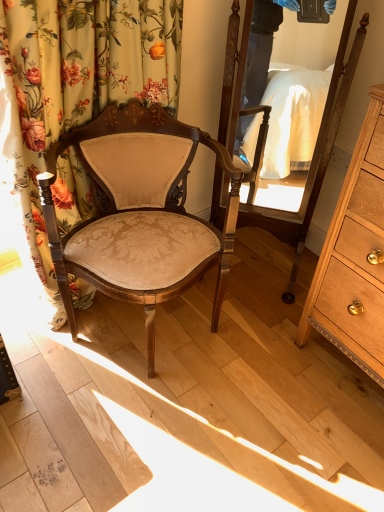
Question: Considering the relative sizes of wooden mirror at center and matte beige fabric chair at center in the image provided, is wooden mirror at center wider than matte beige fabric chair at center?

Choices:
 (A) no
 (B) yes

Answer: (A)

Question: Is wooden mirror at center thinner than matte beige fabric chair at center?

Choices:
 (A) no
 (B) yes

Answer: (B)

Question: Is wooden mirror at center oriented towards matte beige fabric chair at center?

Choices:
 (A) yes
 (B) no

Answer: (A)

Question: Is the position of wooden mirror at center more distant than that of matte beige fabric chair at center?

Choices:
 (A) yes
 (B) no

Answer: (A)

Question: From the image's perspective, is wooden mirror at center located beneath matte beige fabric chair at center?

Choices:
 (A) yes
 (B) no

Answer: (B)

Question: From the image's perspective, is wooden mirror at center located above or below floral fabric curtain at left?

Choices:
 (A) below
 (B) above

Answer: (B)

Question: Is wooden mirror at center wider or thinner than floral fabric curtain at left?

Choices:
 (A) wide
 (B) thin

Answer: (A)

Question: Is wooden mirror at center taller or shorter than floral fabric curtain at left?

Choices:
 (A) tall
 (B) short

Answer: (A)

Question: Is wooden mirror at center to the left or to the right of floral fabric curtain at left in the image?

Choices:
 (A) left
 (B) right

Answer: (B)

Question: From their relative heights in the image, would you say light brown wood dresser at right is taller or shorter than wooden mirror at center?

Choices:
 (A) tall
 (B) short

Answer: (B)

Question: Based on their sizes in the image, would you say light brown wood dresser at right is bigger or smaller than wooden mirror at center?

Choices:
 (A) small
 (B) big

Answer: (B)

Question: In the image, is light brown wood dresser at right on the left side or the right side of wooden mirror at center?

Choices:
 (A) right
 (B) left

Answer: (A)

Question: Is light brown wood dresser at right spatially inside wooden mirror at center, or outside of it?

Choices:
 (A) outside
 (B) inside

Answer: (A)

Question: In terms of size, does light brown wood dresser at right appear bigger or smaller than floral fabric curtain at left?

Choices:
 (A) big
 (B) small

Answer: (A)

Question: In the image, is light brown wood dresser at right on the left side or the right side of floral fabric curtain at left?

Choices:
 (A) left
 (B) right

Answer: (B)